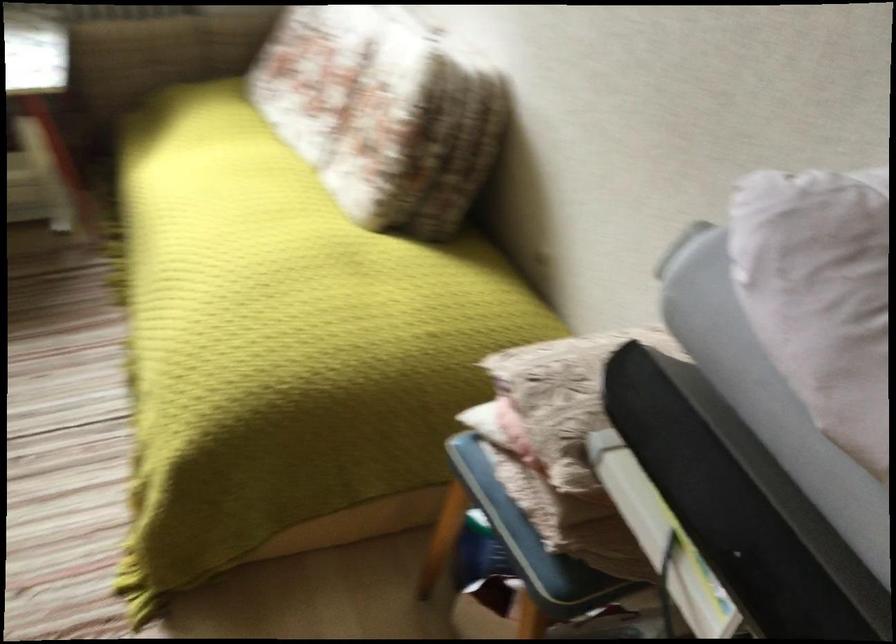
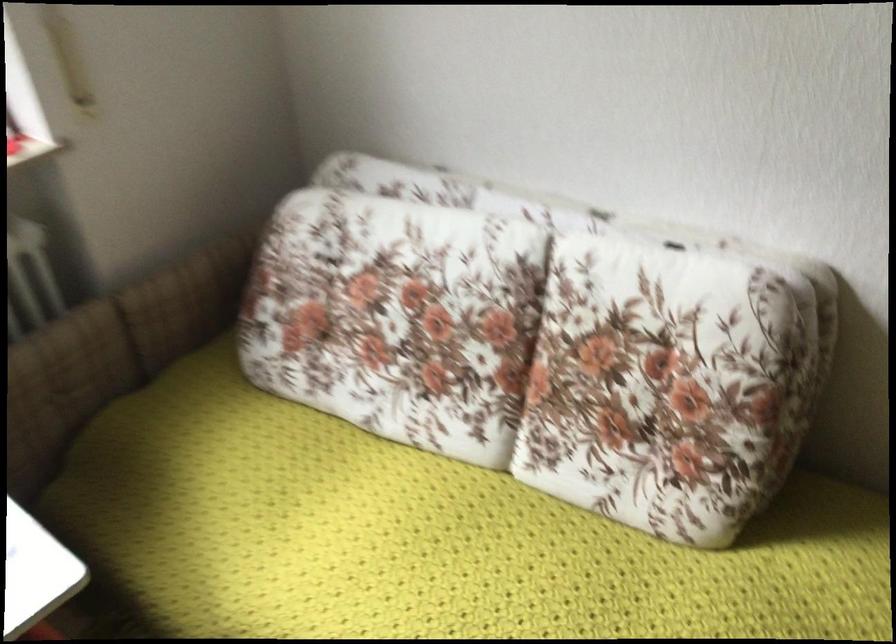
Where in the second image is the point corresponding to [377,104] from the first image?

(650, 359)